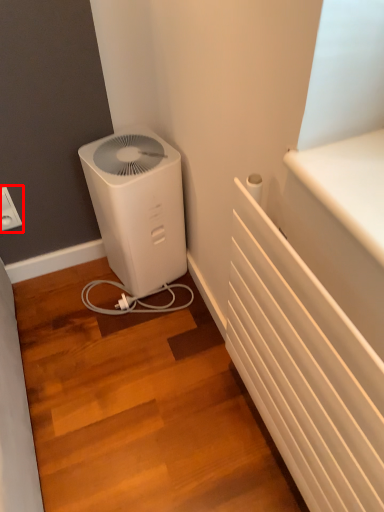
Question: Considering the relative positions of electric outlet (annotated by the red box) and home appliance in the image provided, where is electric outlet (annotated by the red box) located with respect to the staircase?

Choices:
 (A) right
 (B) left

Answer: (B)